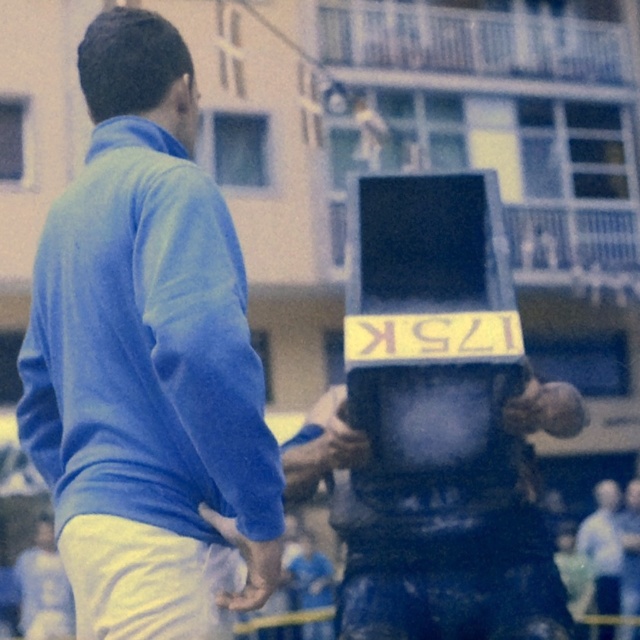
You are an event organizer who needs to place a new banner between the light blue shirt at right and the matte black helmet at center. Given their sizes, which object should the banner be closer to to ensure visibility?

The light blue shirt at right has a larger size compared to the matte black helmet at center, so the banner should be closer to the light blue shirt at right to ensure visibility.

You are a photographer standing at the center of the event. You want to take a photo of the light blue shirt at right and the matte black helmet at center without any obstructions. Given that your camera has a 50mm lens which has a field of view that can capture objects within 12 inches of each other, will you be able to frame both objects in the same shot?

The light blue shirt at right is 14.21 inches away from the matte black helmet at center. Since the distance between them exceeds the camera lens field of view limit of 12 inches, you cannot frame both in the same shot.

You are a photographer at the event and want to take a picture of both the blue matte sweater at upper left and the light blue shirt at right. However, you notice that one of them is blocking the other. Which one is covering part of the other?

The blue matte sweater at upper left is positioned over light blue shirt at right, so it is covering part of the light blue shirt at right.